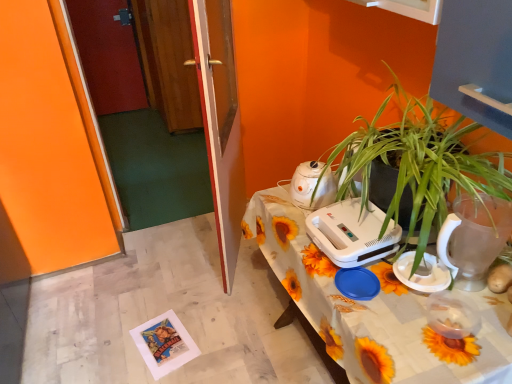
Question: Could you tell me if transparent plastic pitcher at right, the 1th appliance when ordered from front to back, is facing wooden door at left, which is the second glass door from front to back?

Choices:
 (A) no
 (B) yes

Answer: (A)

Question: Is wooden door at left, placed as the 2th glass door when sorted from back to front, at the back of transparent plastic pitcher at right, marked as the fourth appliance in a back-to-front arrangement?

Choices:
 (A) yes
 (B) no

Answer: (B)

Question: Is transparent plastic pitcher at right, marked as the fourth appliance in a back-to-front arrangement, next to wooden door at left, placed as the 2th glass door when sorted from back to front, and touching it?

Choices:
 (A) yes
 (B) no

Answer: (B)

Question: Is transparent plastic pitcher at right, the 1th appliance when ordered from front to back, surrounding wooden door at left, placed as the 2th glass door when sorted from back to front?

Choices:
 (A) no
 (B) yes

Answer: (A)

Question: Is transparent plastic pitcher at right, the 1th appliance when ordered from front to back, outside wooden door at left, placed as the 2th glass door when sorted from back to front?

Choices:
 (A) no
 (B) yes

Answer: (B)

Question: From a real-world perspective, is transparent plastic pitcher at right, marked as the fourth appliance in a back-to-front arrangement, beneath wooden door at left, placed as the 2th glass door when sorted from back to front?

Choices:
 (A) no
 (B) yes

Answer: (A)

Question: Is wooden door at left, placed as the 2th glass door when sorted from back to front, closer to the viewer compared to transparent plastic pitcher at right, the 1th appliance when ordered from front to back?

Choices:
 (A) no
 (B) yes

Answer: (A)

Question: Can you confirm if wooden door at left, which is the second glass door from front to back, is taller than transparent plastic pitcher at right, marked as the fourth appliance in a back-to-front arrangement?

Choices:
 (A) yes
 (B) no

Answer: (A)

Question: Can you confirm if wooden door at left, which is the second glass door from front to back, is thinner than transparent plastic pitcher at right, the 1th appliance when ordered from front to back?

Choices:
 (A) yes
 (B) no

Answer: (A)

Question: Is wooden door at left, placed as the 2th glass door when sorted from back to front, looking in the opposite direction of transparent plastic pitcher at right, the 1th appliance when ordered from front to back?

Choices:
 (A) no
 (B) yes

Answer: (A)

Question: From a real-world perspective, does wooden door at left, which is the second glass door from front to back, sit lower than transparent plastic pitcher at right, marked as the fourth appliance in a back-to-front arrangement?

Choices:
 (A) no
 (B) yes

Answer: (B)

Question: Does wooden door at left, placed as the 2th glass door when sorted from back to front, have a larger size compared to transparent plastic pitcher at right, the 1th appliance when ordered from front to back?

Choices:
 (A) no
 (B) yes

Answer: (B)

Question: Considering the relative sizes of transparent glass door at center, which appears as the third glass door when viewed from the back, and green leafy plant at right in the image provided, is transparent glass door at center, which appears as the third glass door when viewed from the back, bigger than green leafy plant at right?

Choices:
 (A) yes
 (B) no

Answer: (A)